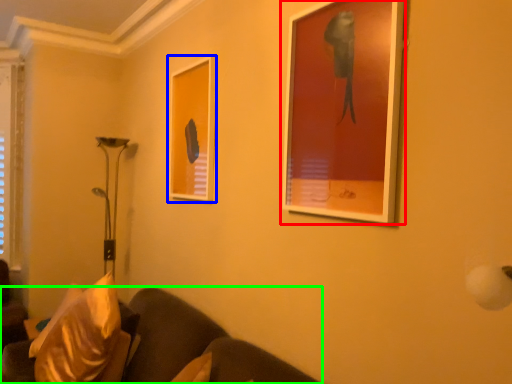
Question: Which object is the farthest from picture frame (highlighted by a red box)? Choose among these: picture frame (highlighted by a blue box) or studio couch (highlighted by a green box).

Choices:
 (A) picture frame
 (B) studio couch

Answer: (B)